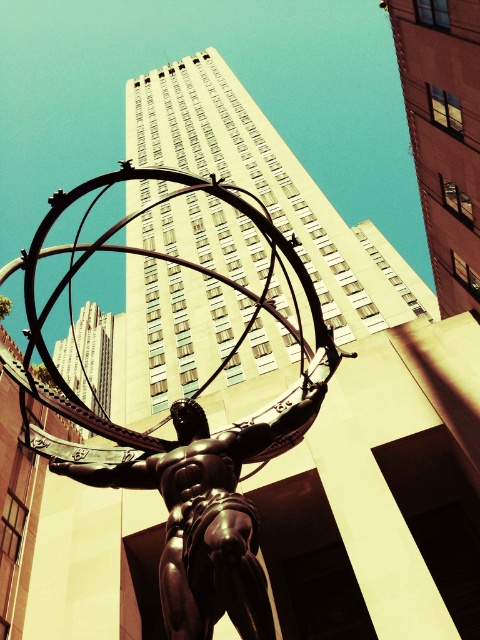
You are standing at the base of the Atlas statue and want to take a photo of the Rockefeller Center in the background. There are two points marked on your camera screen at coordinates point (242, 208) and point (116, 486). Which point should you focus on to ensure the Rockefeller Center is in focus?

You should focus on point (116, 486) because point (242, 208) is behind point (116, 486), meaning the closer point is (116, 486) which is the Rockefeller Center.